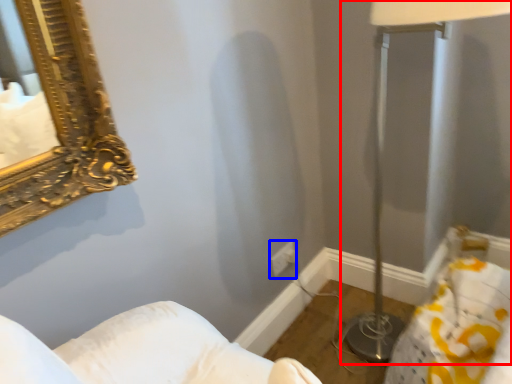
Question: Which of the following is the closest to the observer, table lamp (highlighted by a red box) or electric outlet (highlighted by a blue box)?

Choices:
 (A) table lamp
 (B) electric outlet

Answer: (A)